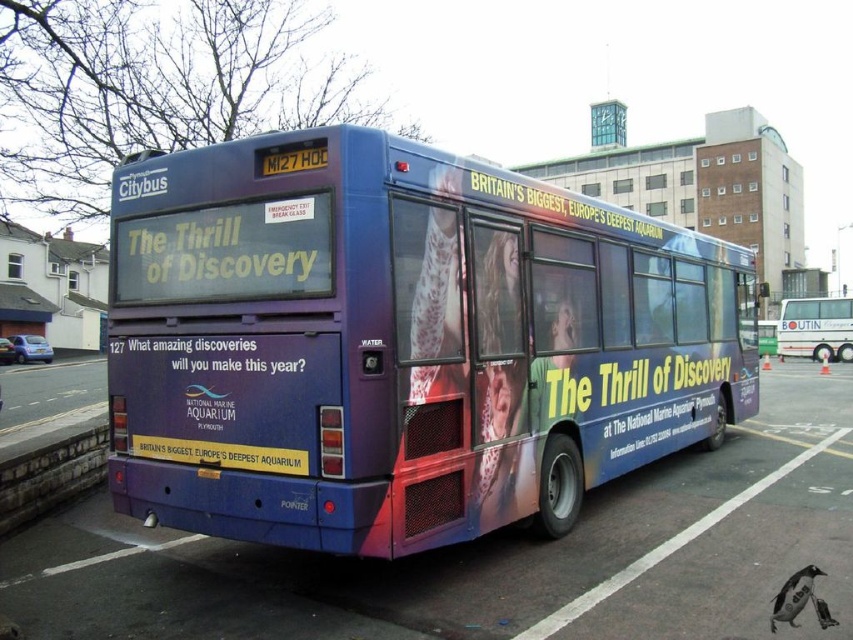
Identify the location of matte purple bus at center. (399, 342).

Can you confirm if matte purple bus at center is positioned to the left of matte white bus at center?

Yes, matte purple bus at center is to the left of matte white bus at center.

Which is in front, point (473, 433) or point (820, 333)?

Point (473, 433)

In order to click on matte purple bus at center in this screenshot , I will do `click(399, 342)`.

Is point (419, 340) positioned in front of point (33, 572)?

Yes, point (419, 340) is closer to viewer.

Does matte purple bus at center have a larger size compared to metallic blue bus at center?

Indeed, matte purple bus at center has a larger size compared to metallic blue bus at center.

The width and height of the screenshot is (853, 640). I want to click on matte purple bus at center, so click(399, 342).

Where is `matte purple bus at center`? matte purple bus at center is located at coordinates (399, 342).

Between metallic blue bus at center and matte white bus at center, which one appears on the right side from the viewer's perspective?

matte white bus at center is more to the right.

Can you confirm if metallic blue bus at center is positioned above matte white bus at center?

Actually, metallic blue bus at center is below matte white bus at center.

Which is behind, point (532, 612) or point (822, 323)?

The point (822, 323) is more distant.

Locate an element on the screen. This screenshot has height=640, width=853. metallic blue bus at center is located at coordinates (494, 556).